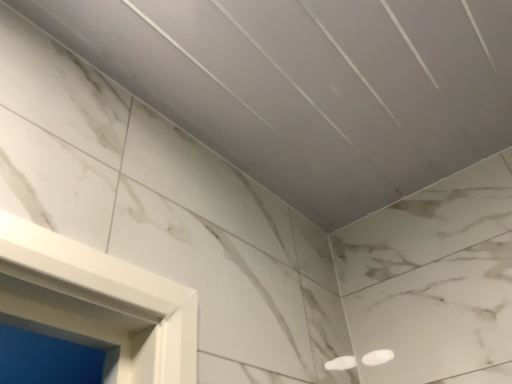
The height and width of the screenshot is (384, 512). What do you see at coordinates (312, 86) in the screenshot?
I see `white matte exhaust hood at upper center` at bounding box center [312, 86].

At what (x,y) coordinates should I click in order to perform the action: click on white matte exhaust hood at upper center. Please return your answer as a coordinate pair (x, y). Looking at the image, I should click on (312, 86).

Where is `white matte exhaust hood at upper center`? This screenshot has height=384, width=512. white matte exhaust hood at upper center is located at coordinates pos(312,86).